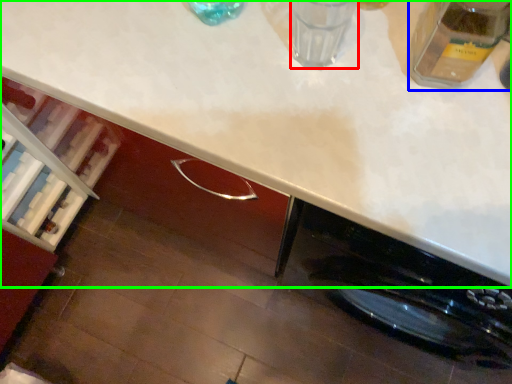
Question: Considering the real-world distances, which object is farthest from water (highlighted by a red box)? glass jar (highlighted by a blue box) or countertop (highlighted by a green box)?

Choices:
 (A) glass jar
 (B) countertop

Answer: (B)